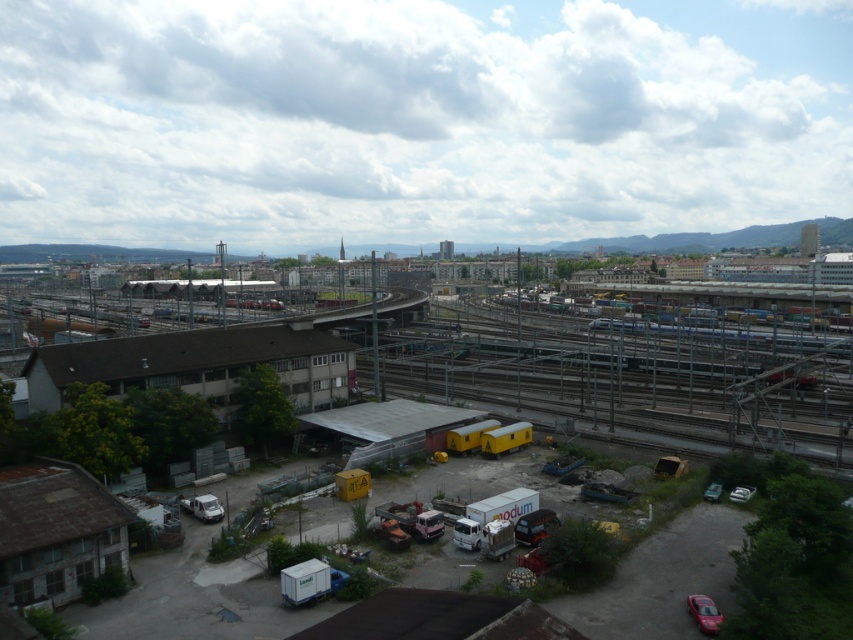
You are a delivery person who needs to park your 2.5 meter wide van between the shiny red car at bottom right and the metallic silver car at lower right. Can you fit your van there based on the space between them?

The shiny red car at bottom right might be wider than metallic silver car at lower right, so the space between them is uncertain. You should check the actual width before attempting to park your van there.

You are a delivery driver who needs to park your vehicle in this area. You see a shiny red car at bottom right and a metallic silver car at lower right. Which car is parked closer to the ground?

The shiny red car at bottom right is below metallic silver car at lower right, so it is parked closer to the ground.

You are standing at the point marked as point (x=192, y=600) in the urban railway yard. What type of train cars are you currently standing on?

You are standing on yellow matte train cars at center.